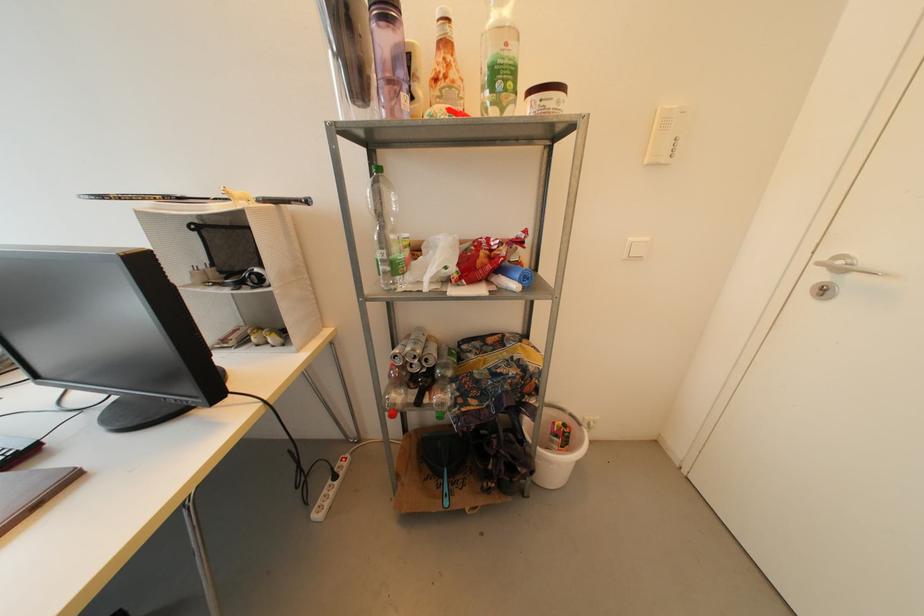
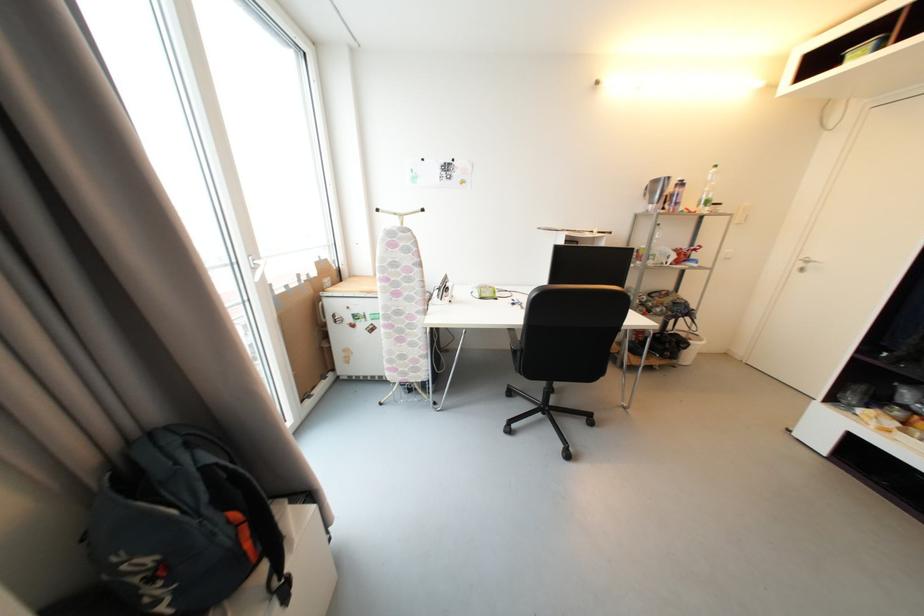
Find the pixel in the second image that matches pixel 823 278 in the first image.

(806, 267)